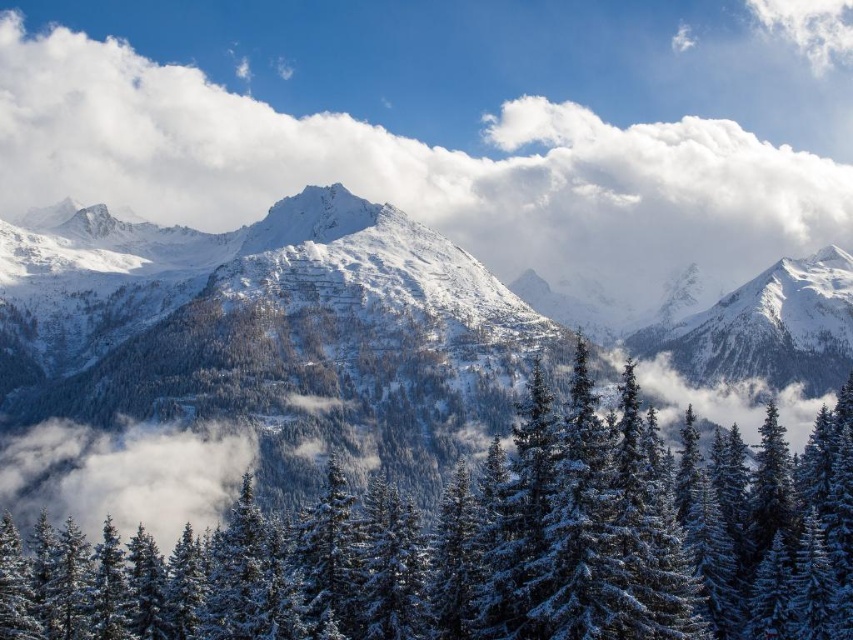
Question: Where is snow-covered pine trees at center located in relation to white snow-covered peak at center in the image?

Choices:
 (A) below
 (B) above

Answer: (A)

Question: Is white fluffy cloud at upper center further to the viewer compared to white fluffy cloud at lower left?

Choices:
 (A) no
 (B) yes

Answer: (B)

Question: Which of the following is the farthest from the observer?

Choices:
 (A) (39, 435)
 (B) (457, 189)
 (C) (245, 244)

Answer: (B)

Question: Is white fluffy cloud at upper center bigger than white snow-covered peak at center?

Choices:
 (A) yes
 (B) no

Answer: (A)

Question: Estimate the real-world distances between objects in this image. Which object is closer to the white fluffy cloud at upper center?

Choices:
 (A) snow-covered pine trees at center
 (B) white fluffy cloud at lower left
 (C) white snow-covered peak at center

Answer: (C)

Question: Which of these objects is positioned farthest from the white snow-covered peak at center?

Choices:
 (A) snow-covered pine trees at center
 (B) white fluffy cloud at upper center
 (C) white fluffy cloud at lower left

Answer: (B)